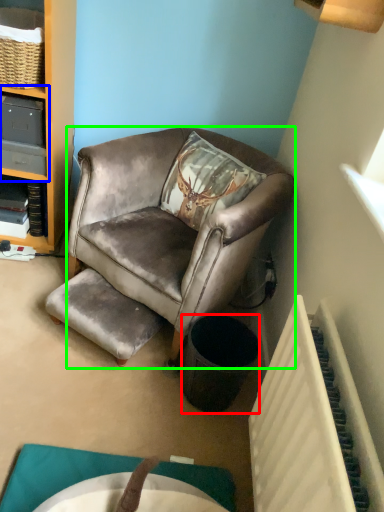
Question: Estimate the real-world distances between objects in this image. Which object is closer to trash bin/can (highlighted by a red box), shelf (highlighted by a blue box) or chair (highlighted by a green box)?

Choices:
 (A) shelf
 (B) chair

Answer: (B)